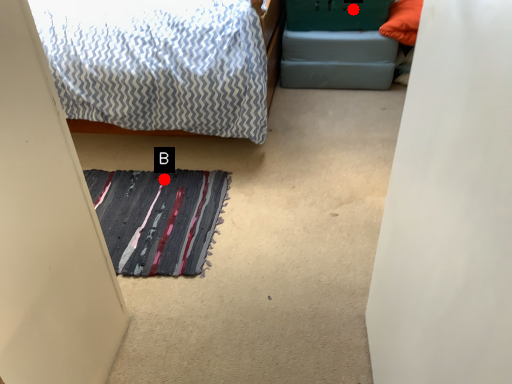
Question: Two points are circled on the image, labeled by A and B beside each circle. Which of the following is the closest to the observer?

Choices:
 (A) A is closer
 (B) B is closer

Answer: (B)